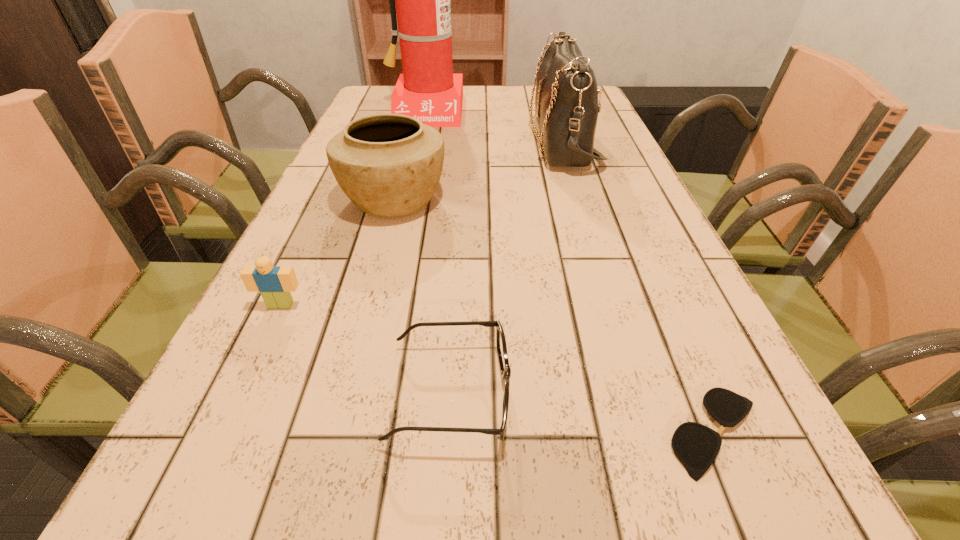
Where is `pottery at the left edge`? This screenshot has width=960, height=540. pottery at the left edge is located at coordinates (388, 165).

Where is `Lego present at the left edge`? This screenshot has height=540, width=960. Lego present at the left edge is located at coordinates (275, 283).

The image size is (960, 540). What are the coordinates of `handbag located in the right edge section of the desktop` in the screenshot? It's located at (566, 100).

Where is `spectacles that is at the right edge`? This screenshot has width=960, height=540. spectacles that is at the right edge is located at coordinates (696, 446).

This screenshot has width=960, height=540. In order to click on object located at the far left corner in this screenshot , I will do `click(427, 90)`.

This screenshot has height=540, width=960. Find the location of `object present at the far right corner`. object present at the far right corner is located at coordinates coord(566,100).

Image resolution: width=960 pixels, height=540 pixels. Identify the location of vacant space at the far edge. (485, 91).

The image size is (960, 540). I want to click on free space at the left edge of the desktop, so click(x=334, y=318).

In the image, there is a desktop. Identify the location of blank space at the right edge. The height and width of the screenshot is (540, 960). (632, 208).

At what (x,y) coordinates should I click in order to perform the action: click on blank space at the far left corner of the desktop. Please return your answer as a coordinate pair (x, y). Image resolution: width=960 pixels, height=540 pixels. Looking at the image, I should click on (372, 90).